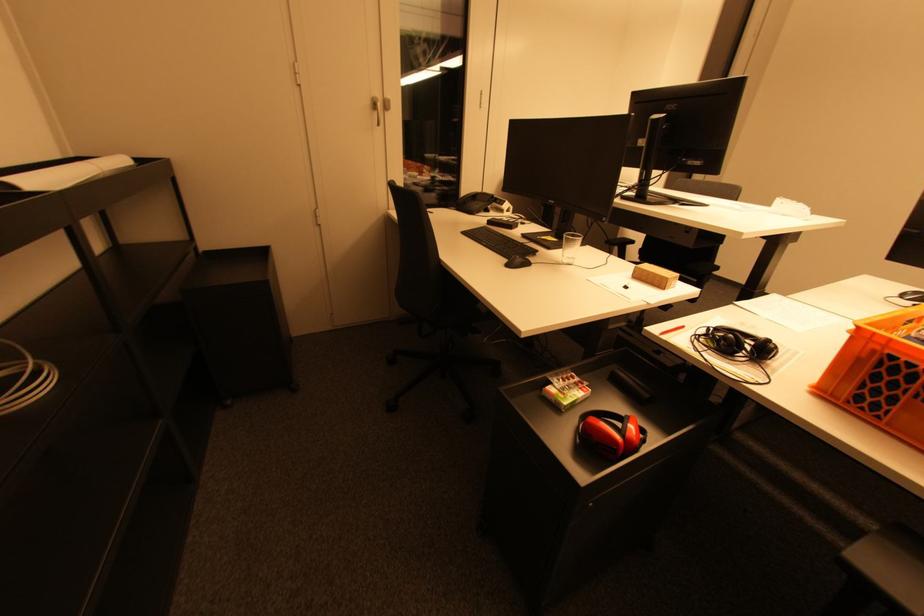
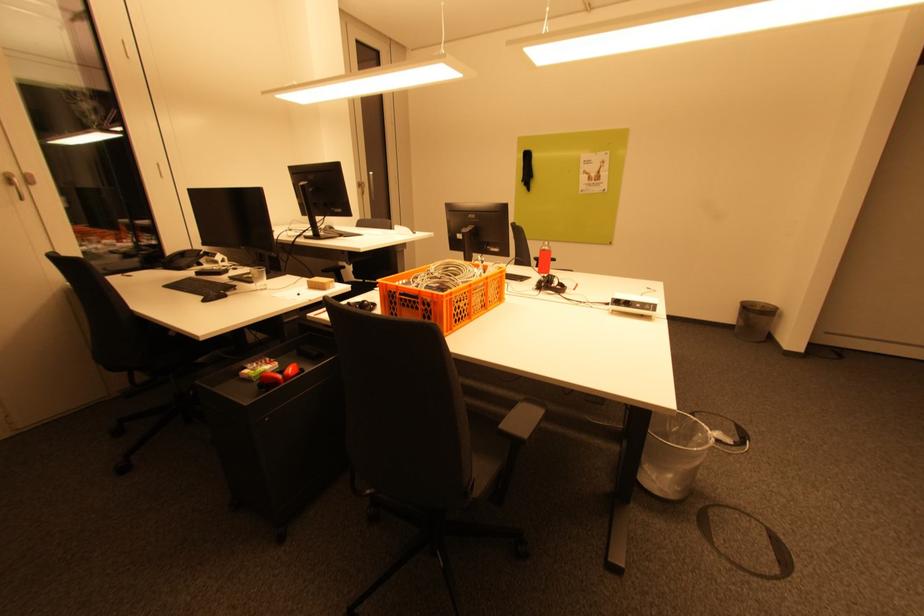
Question: How did the camera likely rotate?

Choices:
 (A) Left
 (B) Right
 (C) Up
 (D) Down

Answer: (B)